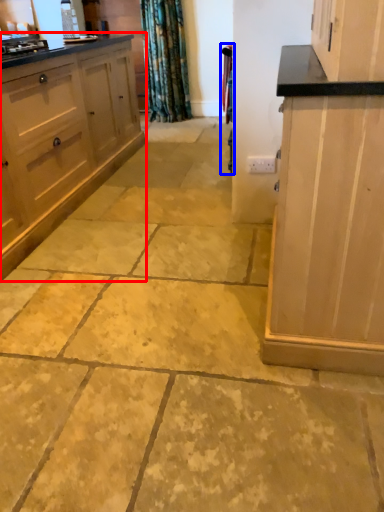
Question: Which object is further to the camera taking this photo, cabinetry (highlighted by a red box) or curtain (highlighted by a blue box)?

Choices:
 (A) cabinetry
 (B) curtain

Answer: (B)